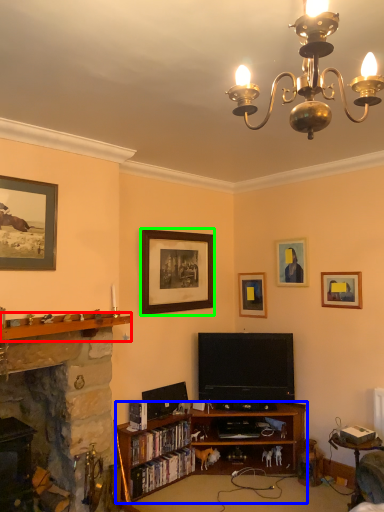
Question: Considering the real-world distances, which object is farthest from shelf (highlighted by a red box)? bookcase (highlighted by a blue box) or picture frame (highlighted by a green box)?

Choices:
 (A) bookcase
 (B) picture frame

Answer: (A)